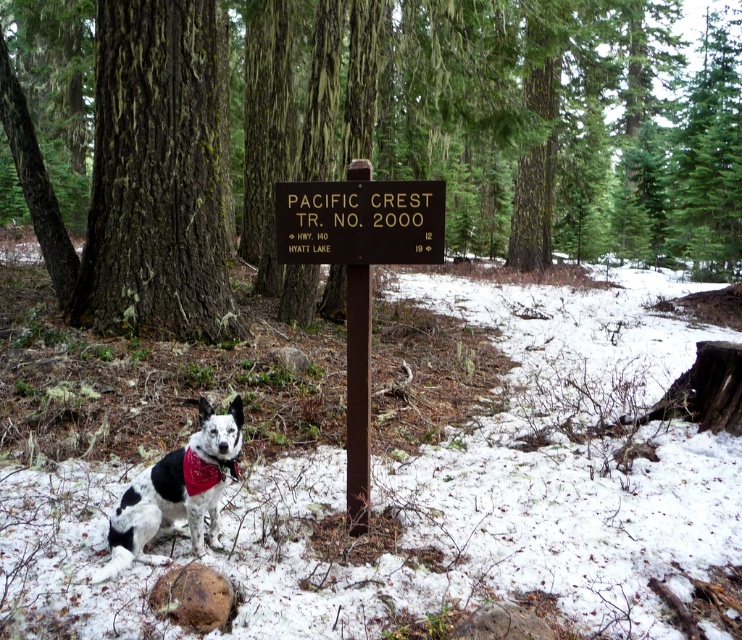
You are a hiker trying to read the directions on the wooden signpost in the forest. There are two points marked on the signpost at coordinates point (485, 74) and point (344, 200). Which point is closer to the top edge of the signpost?

Point (344, 200) is closer to the top edge of the signpost because it has a lower y coordinate than point (485, 74).

What is the relationship between the sizes of the brown rough bark tree at center and the brown wooden sign at center in the winter forest scene?

The brown rough bark tree at center is larger in size than the brown wooden sign at center.

What is the spatial relationship between the smooth bark tree at center and the brown wooden sign at center in the winter forest scene?

The smooth bark tree at center is located above the brown wooden sign at center, meaning the tree is positioned higher up in the image compared to the sign.